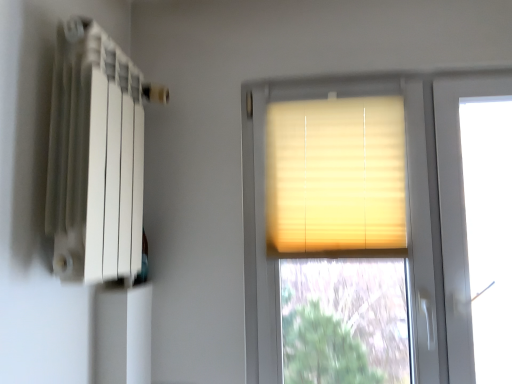
Question: Can you confirm if beige fabric blinds at center is positioned to the left of matte yellow blinds at center?

Choices:
 (A) yes
 (B) no

Answer: (A)

Question: Is beige fabric blinds at center beside matte yellow blinds at center?

Choices:
 (A) no
 (B) yes

Answer: (B)

Question: Is beige fabric blinds at center thinner than matte yellow blinds at center?

Choices:
 (A) no
 (B) yes

Answer: (B)

Question: From the image's perspective, is beige fabric blinds at center located above matte yellow blinds at center?

Choices:
 (A) yes
 (B) no

Answer: (A)

Question: Is beige fabric blinds at center outside of matte yellow blinds at center?

Choices:
 (A) no
 (B) yes

Answer: (A)

Question: From the image's perspective, relative to matte yellow blinds at center, is white matte radiator at left above or below?

Choices:
 (A) below
 (B) above

Answer: (B)

Question: Considering their positions, is white matte radiator at left located in front of or behind matte yellow blinds at center?

Choices:
 (A) front
 (B) behind

Answer: (A)

Question: Is white matte radiator at left inside or outside of matte yellow blinds at center?

Choices:
 (A) outside
 (B) inside

Answer: (A)

Question: Is white matte radiator at left taller or shorter than matte yellow blinds at center?

Choices:
 (A) tall
 (B) short

Answer: (B)

Question: Based on their sizes in the image, would you say beige fabric blinds at center is bigger or smaller than white matte radiator at left?

Choices:
 (A) big
 (B) small

Answer: (B)

Question: In terms of height, does beige fabric blinds at center look taller or shorter compared to white matte radiator at left?

Choices:
 (A) tall
 (B) short

Answer: (B)

Question: Is point (269, 195) positioned closer to the camera than point (91, 142)?

Choices:
 (A) closer
 (B) farther

Answer: (B)

Question: From the image's perspective, is beige fabric blinds at center positioned above or below white matte radiator at left?

Choices:
 (A) above
 (B) below

Answer: (B)

Question: Is point (437, 322) positioned closer to the camera than point (67, 92)?

Choices:
 (A) farther
 (B) closer

Answer: (A)

Question: Based on their sizes in the image, would you say matte yellow blinds at center is bigger or smaller than white matte radiator at left?

Choices:
 (A) small
 (B) big

Answer: (B)